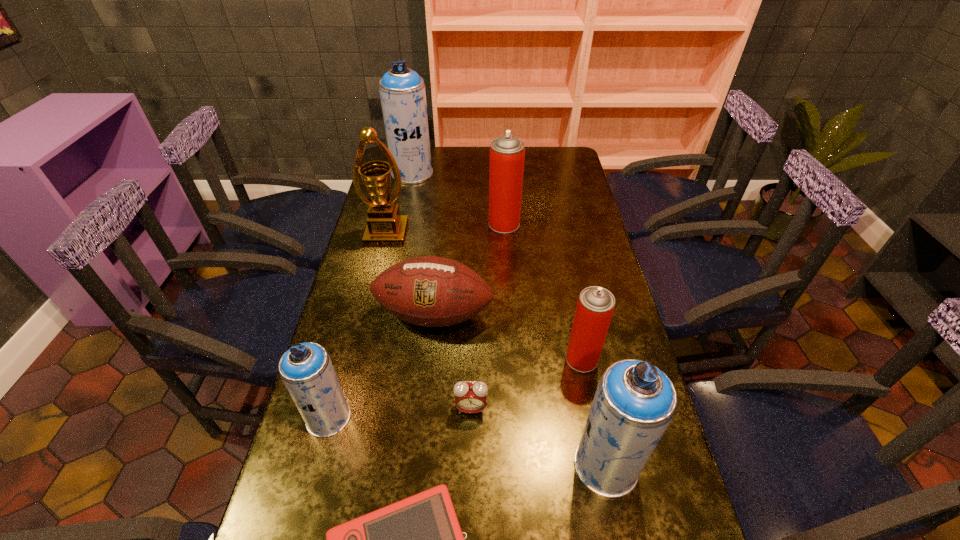
Where is `free space that satisfies the following two spatial constraints: 1. on the front-facing side of the third shortest object; 2. on the right side of the gold award`? The width and height of the screenshot is (960, 540). free space that satisfies the following two spatial constraints: 1. on the front-facing side of the third shortest object; 2. on the right side of the gold award is located at coordinates click(367, 315).

Where is `vacant space that satisfies the following two spatial constraints: 1. on the front side of the third nearest aerosol can; 2. on the right side of the farthest object`? This screenshot has height=540, width=960. vacant space that satisfies the following two spatial constraints: 1. on the front side of the third nearest aerosol can; 2. on the right side of the farthest object is located at coordinates (373, 359).